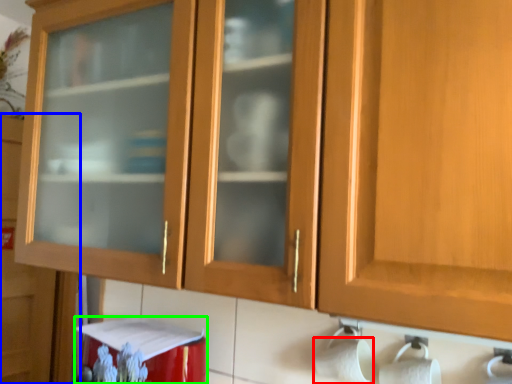
Question: Which object is the closest to the toilet paper (highlighted by a red box)? Choose among these: cupboard (highlighted by a blue box) or appliance (highlighted by a green box).

Choices:
 (A) cupboard
 (B) appliance

Answer: (B)